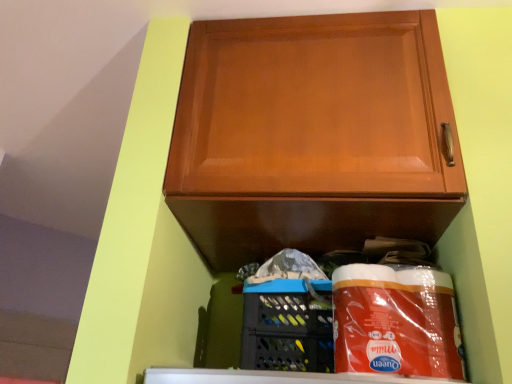
Question: Does matte black basket at lower center have a lesser height compared to glossy wood cabinet at upper center?

Choices:
 (A) no
 (B) yes

Answer: (B)

Question: From a real-world perspective, is matte black basket at lower center beneath glossy wood cabinet at upper center?

Choices:
 (A) no
 (B) yes

Answer: (B)

Question: Is the position of matte black basket at lower center more distant than that of glossy wood cabinet at upper center?

Choices:
 (A) yes
 (B) no

Answer: (A)

Question: Is matte black basket at lower center far from glossy wood cabinet at upper center?

Choices:
 (A) yes
 (B) no

Answer: (B)

Question: Can you confirm if matte black basket at lower center is wider than glossy wood cabinet at upper center?

Choices:
 (A) no
 (B) yes

Answer: (A)

Question: From the image's perspective, would you say matte black basket at lower center is positioned over glossy wood cabinet at upper center?

Choices:
 (A) no
 (B) yes

Answer: (A)

Question: Considering the relative sizes of glossy wood cabinet at upper center and matte black basket at lower center in the image provided, is glossy wood cabinet at upper center taller than matte black basket at lower center?

Choices:
 (A) no
 (B) yes

Answer: (B)

Question: From the image's perspective, is glossy wood cabinet at upper center beneath matte black basket at lower center?

Choices:
 (A) yes
 (B) no

Answer: (B)

Question: Considering the relative sizes of glossy wood cabinet at upper center and matte black basket at lower center in the image provided, is glossy wood cabinet at upper center thinner than matte black basket at lower center?

Choices:
 (A) yes
 (B) no

Answer: (B)

Question: From the image's perspective, is glossy wood cabinet at upper center above matte black basket at lower center?

Choices:
 (A) yes
 (B) no

Answer: (A)

Question: From a real-world perspective, is glossy wood cabinet at upper center on top of matte black basket at lower center?

Choices:
 (A) no
 (B) yes

Answer: (B)

Question: Is glossy wood cabinet at upper center wider than matte black basket at lower center?

Choices:
 (A) no
 (B) yes

Answer: (B)

Question: Is glossy wood cabinet at upper center to the left or to the right of matte black basket at lower center in the image?

Choices:
 (A) left
 (B) right

Answer: (B)